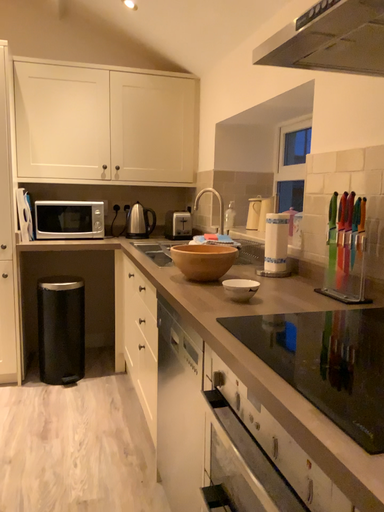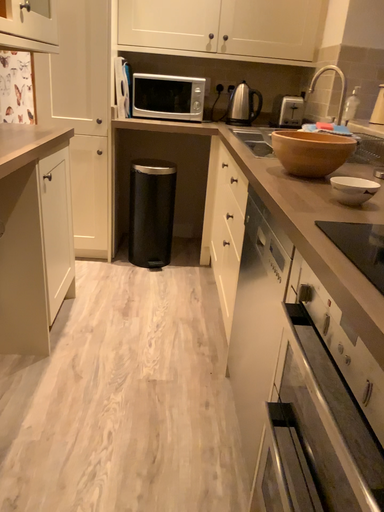
Question: How did the camera likely rotate when shooting the video?

Choices:
 (A) rotated left
 (B) rotated right

Answer: (A)